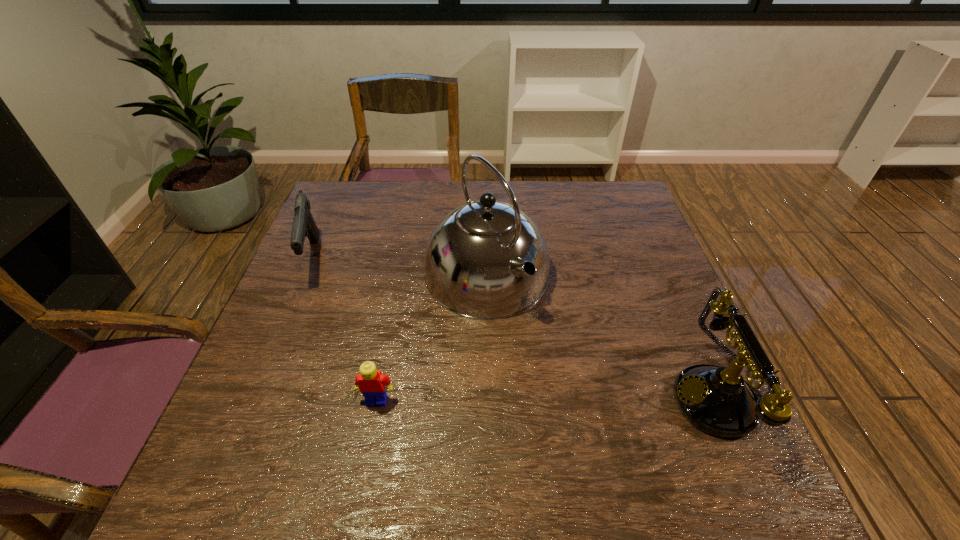
This screenshot has height=540, width=960. Identify the location of vacant spot on the desktop that is between the third object from right to left and the rightmost object and is positioned from the spout of the third object from left to right. (591, 399).

In order to click on vacant space on the desktop that is between the Lego and the third shortest object and is positioned at the muzzle of the leftmost object in this screenshot , I will do `click(506, 400)`.